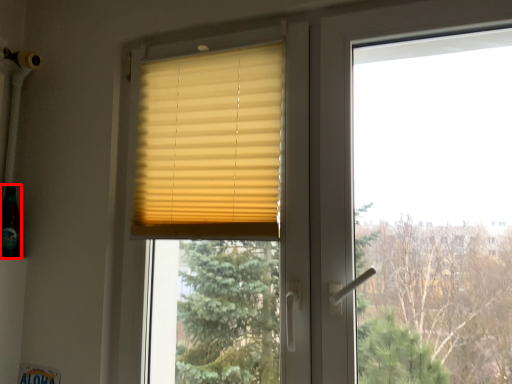
Question: In this image, where is champagne (annotated by the red box) located relative to window blind?

Choices:
 (A) left
 (B) right

Answer: (A)